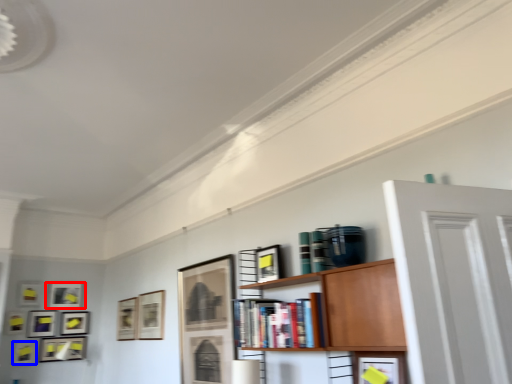
Question: Which point is further to the camera, picture frame (highlighted by a red box) or picture frame (highlighted by a blue box)?

Choices:
 (A) picture frame
 (B) picture frame

Answer: (A)